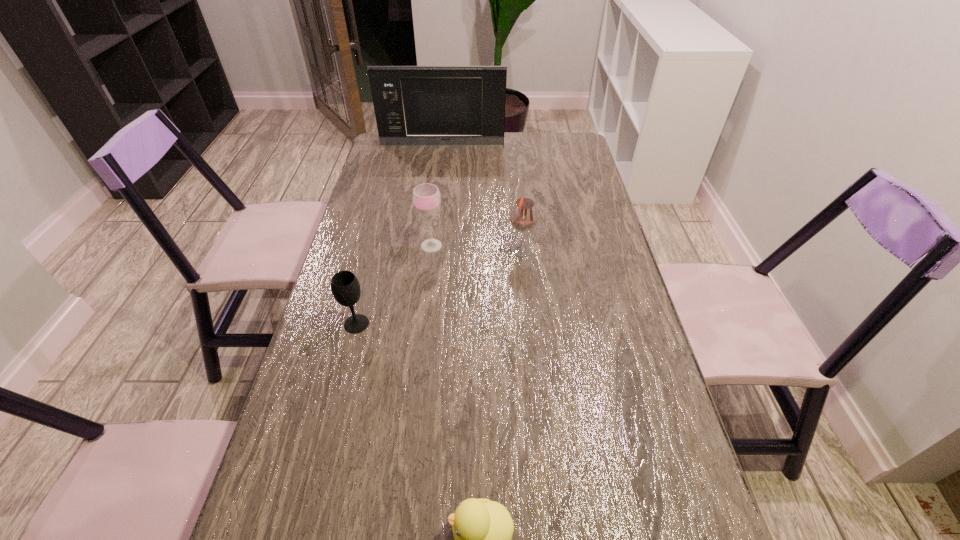
Find the location of a particular element. Image resolution: width=960 pixels, height=540 pixels. vacant area that lies between the rightmost wineglass and the tallest object is located at coordinates (482, 198).

Where is `vacant space that's between the second wineglass from right to left and the rightmost wineglass`? vacant space that's between the second wineglass from right to left and the rightmost wineglass is located at coordinates (476, 248).

Image resolution: width=960 pixels, height=540 pixels. In order to click on vacant space in between the fourth farthest object and the tallest object in this screenshot , I will do coord(399,234).

This screenshot has width=960, height=540. I want to click on unoccupied position between the second wineglass from right to left and the second nearest object, so click(x=394, y=285).

You are a GUI agent. You are given a task and a screenshot of the screen. Output one action in this format:
    pyautogui.click(x=<x>, y=<y>)
    Task: Click on the object that ranks as the third closest to the fourth farthest object
    This screenshot has width=960, height=540.
    Given the screenshot: What is the action you would take?
    pyautogui.click(x=482, y=529)

Where is `object that stands as the fourth closest to the leftmost wineglass`? The height and width of the screenshot is (540, 960). object that stands as the fourth closest to the leftmost wineglass is located at coordinates [x=414, y=105].

Point out which wineglass is positioned as the nearest to the microwave oven. Please provide its 2D coordinates. Your answer should be formatted as a tuple, i.e. [(x, y)], where the tuple contains the x and y coordinates of a point satisfying the conditions above.

[(426, 197)]

You are a GUI agent. You are given a task and a screenshot of the screen. Output one action in this format:
    pyautogui.click(x=<x>, y=<y>)
    Task: Click on the wineglass that can be found as the closest to the leftmost wineglass
    
    Given the screenshot: What is the action you would take?
    click(x=426, y=197)

Where is `vacant space that satisfies the following two spatial constraints: 1. on the back side of the second wineglass from right to left; 2. on the right side of the leftmost wineglass`? vacant space that satisfies the following two spatial constraints: 1. on the back side of the second wineglass from right to left; 2. on the right side of the leftmost wineglass is located at coordinates (376, 246).

At what (x,y) coordinates should I click in order to perform the action: click on vacant space that satisfies the following two spatial constraints: 1. on the front panel of the microwave oven; 2. on the left side of the second wineglass from right to left. Please return your answer as a coordinate pair (x, y). Image resolution: width=960 pixels, height=540 pixels. Looking at the image, I should click on [430, 246].